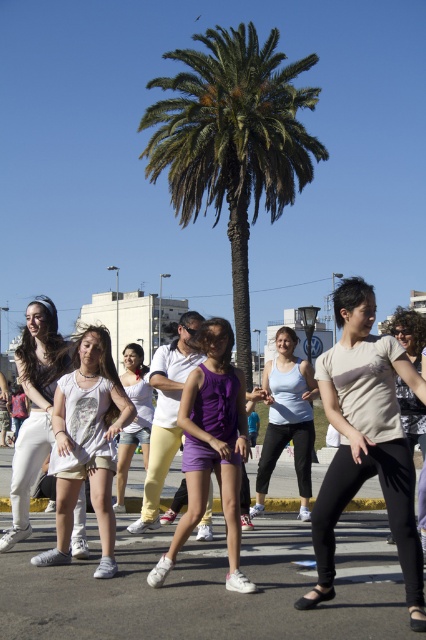
Does green leafy palm at center appear on the left side of purple fabric dress at center?

No, green leafy palm at center is not to the left of purple fabric dress at center.

Which is in front, point (293, 152) or point (129, 440)?

Point (129, 440)

Where is `green leafy palm at center`? This screenshot has width=426, height=640. green leafy palm at center is located at coordinates (233, 141).

Which of these two, matte beige shirt at center or purple fabric dress at center, stands taller?

matte beige shirt at center is taller.

Between point (319, 596) and point (129, 456), which one is positioned behind?

Point (129, 456)

In order to click on matte beige shirt at center in this screenshot , I will do [x=365, y=440].

Which is in front, point (227, 419) or point (37, 420)?

Point (227, 419) is in front.

Can you confirm if purple matte shorts at center is positioned below white matte pants at center?

Actually, purple matte shorts at center is above white matte pants at center.

Who is more distant from viewer, (235, 579) or (39, 317)?

Point (39, 317)

Locate an element on the screen. The image size is (426, 640). purple matte shorts at center is located at coordinates (212, 445).